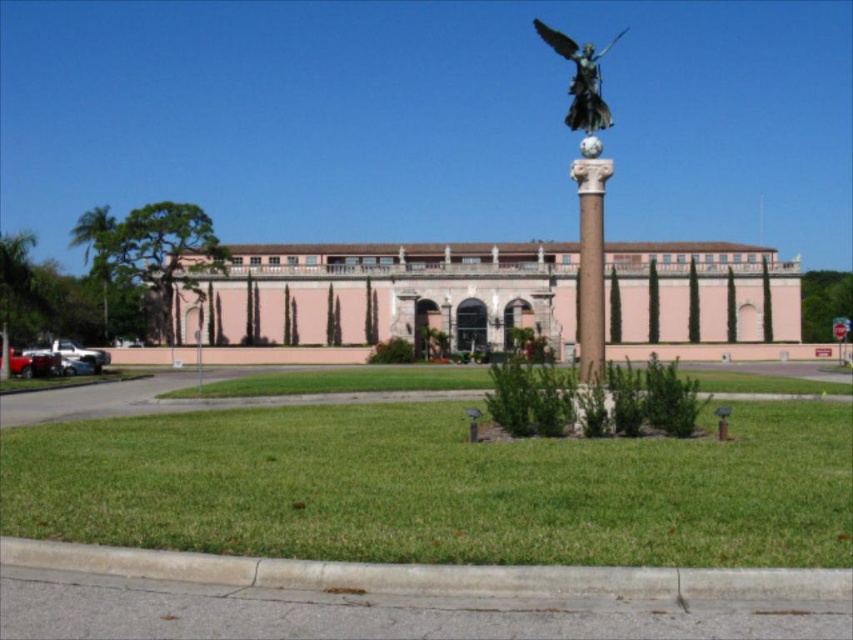
Is white marble column at center positioned at the back of bronze statue at center?

No.

Who is more forward, (606, 173) or (578, 113)?

Point (606, 173) is in front.

I want to click on white marble column at center, so click(x=590, y=260).

Is the position of pink stone building at center less distant than that of bronze statue at center?

No, it is behind bronze statue at center.

Who is more distant from viewer, [624,276] or [595,92]?

Point [624,276]

Locate an element on the screen. pink stone building at center is located at coordinates pyautogui.click(x=383, y=294).

Is pink stone building at center wider than white marble column at center?

Yes.

Between pink stone building at center and white marble column at center, which one appears on the left side from the viewer's perspective?

pink stone building at center

Does point (537, 264) lie in front of point (607, 168)?

That is False.

The image size is (853, 640). In order to click on pink stone building at center in this screenshot , I will do `click(383, 294)`.